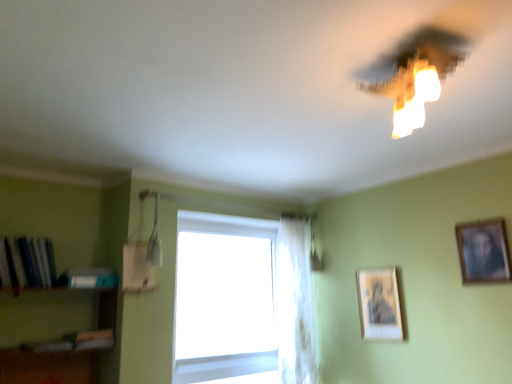
Question: From a real-world perspective, is hardcover book at left, arranged as the 1th book when viewed from the right, physically below matte gold picture frame at center-right, arranged as the 1th picture frame when ordered from the bottom?

Choices:
 (A) no
 (B) yes

Answer: (A)

Question: Does hardcover book at left, arranged as the 2th book when viewed from the left, have a lesser width compared to matte gold picture frame at center-right, arranged as the 1th picture frame when ordered from the bottom?

Choices:
 (A) no
 (B) yes

Answer: (A)

Question: Is hardcover book at left, arranged as the 1th book when viewed from the right, outside matte gold picture frame at center-right, arranged as the 1th picture frame when ordered from the bottom?

Choices:
 (A) yes
 (B) no

Answer: (A)

Question: Can you confirm if hardcover book at left, arranged as the 2th book when viewed from the left, is taller than matte gold picture frame at center-right, which is counted as the first picture frame, starting from the left?

Choices:
 (A) no
 (B) yes

Answer: (A)

Question: Is hardcover book at left, arranged as the 1th book when viewed from the right, beside matte gold picture frame at center-right, which is counted as the 2th picture frame, starting from the right?

Choices:
 (A) no
 (B) yes

Answer: (A)

Question: Relative to hardcover book at left, arranged as the 2th book when viewed from the left, is wooden framed portrait at upper right, the first picture frame when ordered from top to bottom, in front or behind?

Choices:
 (A) behind
 (B) front

Answer: (B)

Question: Would you say wooden framed portrait at upper right, which is counted as the second picture frame, starting from the left, is to the left or to the right of hardcover book at left, arranged as the 1th book when viewed from the right, in the picture?

Choices:
 (A) left
 (B) right

Answer: (B)

Question: Is wooden framed portrait at upper right, which appears as the second picture frame when ordered from the bottom, wider or thinner than hardcover book at left, arranged as the 2th book when viewed from the left?

Choices:
 (A) thin
 (B) wide

Answer: (A)

Question: From the image's perspective, is wooden framed portrait at upper right, which appears as the second picture frame when ordered from the bottom, above or below hardcover book at left, arranged as the 1th book when viewed from the right?

Choices:
 (A) below
 (B) above

Answer: (B)

Question: In terms of size, does white sheer curtain at center appear bigger or smaller than transparent glass window at center?

Choices:
 (A) big
 (B) small

Answer: (B)

Question: Is white sheer curtain at center taller or shorter than transparent glass window at center?

Choices:
 (A) tall
 (B) short

Answer: (A)

Question: From the image's perspective, relative to transparent glass window at center, is white sheer curtain at center above or below?

Choices:
 (A) above
 (B) below

Answer: (A)

Question: Which is correct: white sheer curtain at center is inside transparent glass window at center, or outside of it?

Choices:
 (A) outside
 (B) inside

Answer: (A)

Question: Considering the positions of point (286, 286) and point (399, 127), is point (286, 286) closer or farther from the camera than point (399, 127)?

Choices:
 (A) farther
 (B) closer

Answer: (A)

Question: From the image's perspective, relative to matte white light fixture at upper right, is transparent glass window at center above or below?

Choices:
 (A) below
 (B) above

Answer: (A)